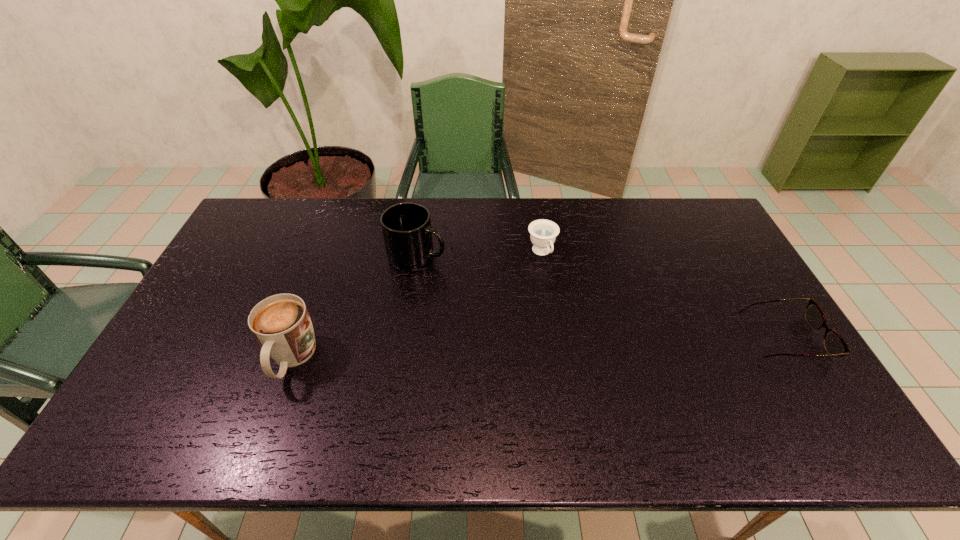
Locate an element on the screen. The height and width of the screenshot is (540, 960). the nearer mug is located at coordinates 281,323.

Identify the location of the leftmost object. (281, 323).

The width and height of the screenshot is (960, 540). I want to click on the rightmost object, so click(x=835, y=345).

Locate an element on the screen. spectacles is located at coordinates (835, 345).

Where is `the farther mug`? This screenshot has height=540, width=960. the farther mug is located at coordinates (406, 227).

Image resolution: width=960 pixels, height=540 pixels. Identify the location of the right mug. (406, 227).

Find the location of a particular element. The height and width of the screenshot is (540, 960). the third tallest object is located at coordinates (543, 232).

In order to click on teacup in this screenshot , I will do (543, 232).

The image size is (960, 540). I want to click on free point located with the handle on the side of the farther mug, so click(x=498, y=298).

This screenshot has width=960, height=540. I want to click on vacant position located 0.230m with the handle on the side of the farther mug, so click(498, 298).